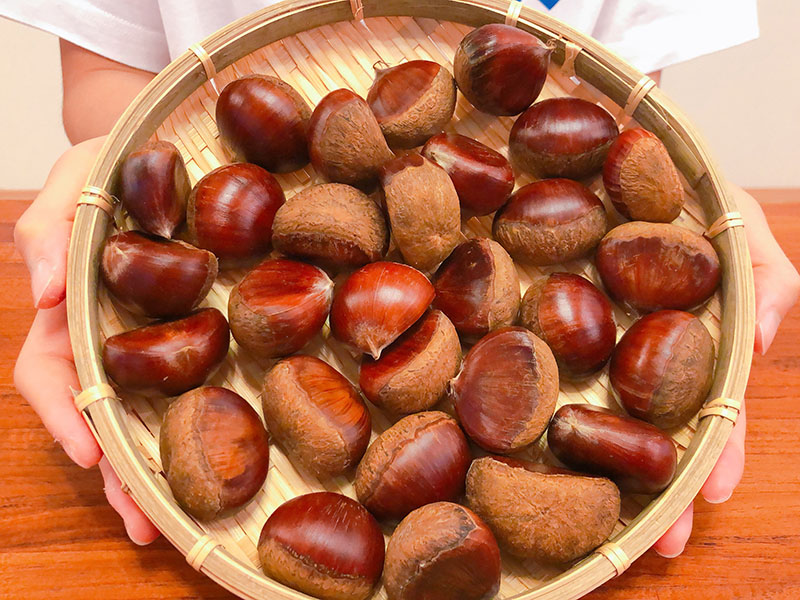
Where is `table`? table is located at coordinates (726, 561), (50, 511).